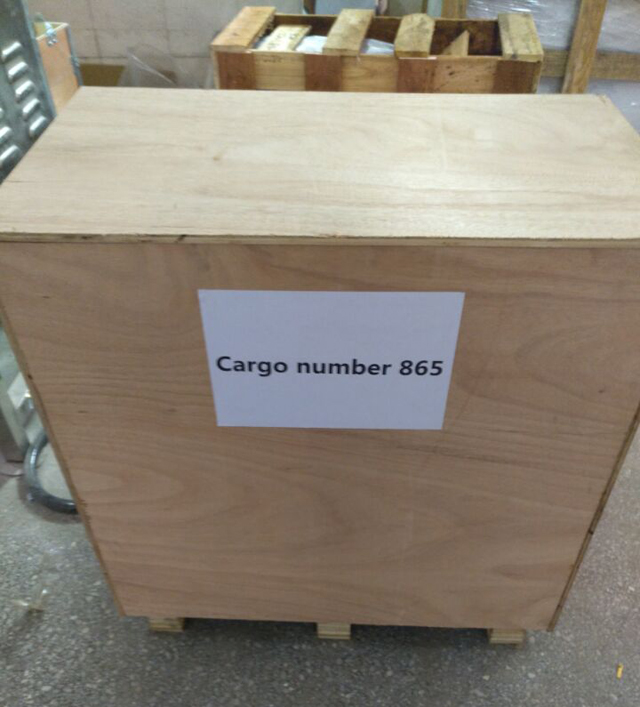
Where is `2nd wooden box`? 2nd wooden box is located at coordinates (445, 73).